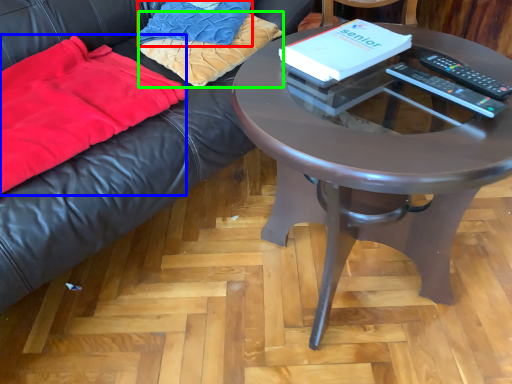
Question: Which is farther away from pillow (highlighted by a red box)? blanket (highlighted by a blue box) or pillow (highlighted by a green box)?

Choices:
 (A) blanket
 (B) pillow

Answer: (A)